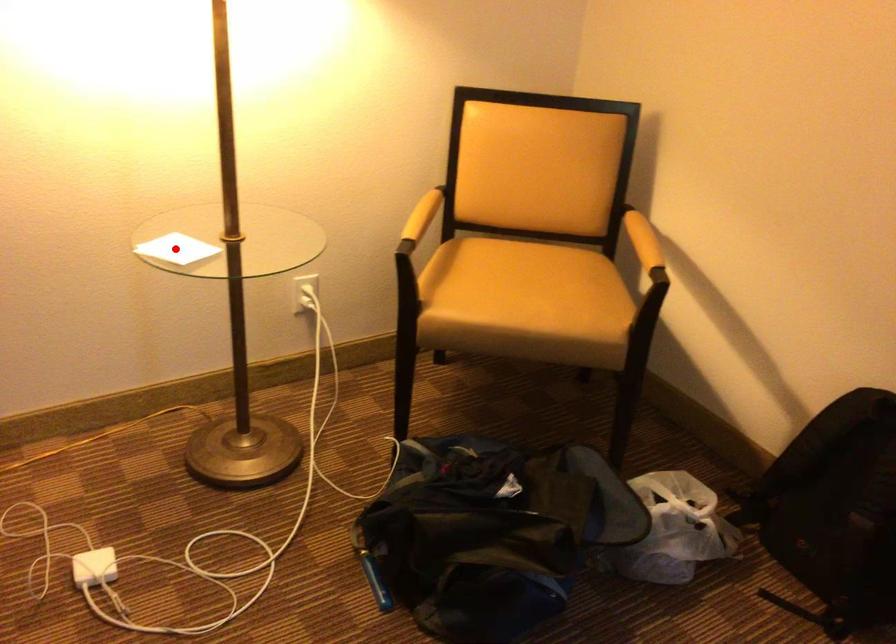
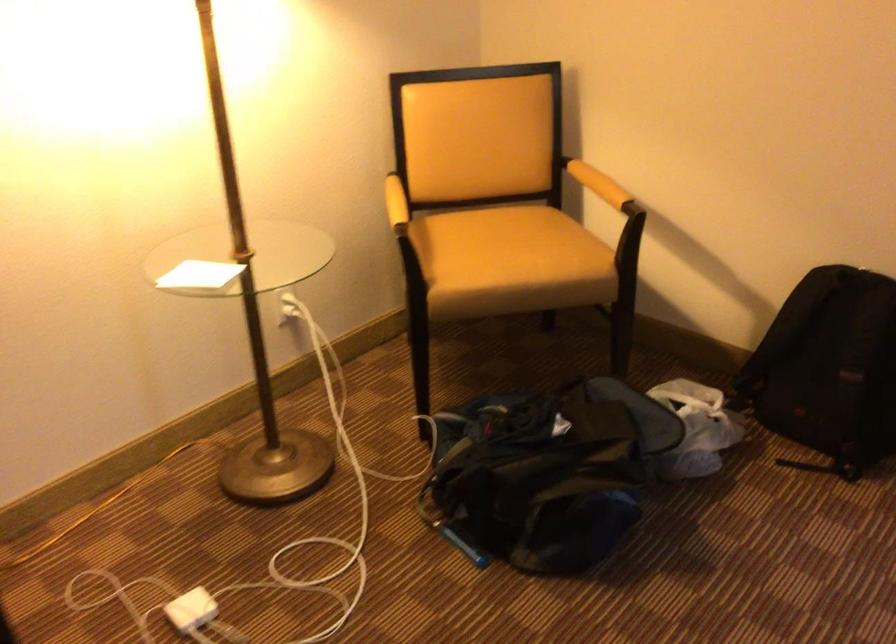
Where in the second image is the point corresponding to the highlighted location from the first image?

(199, 275)